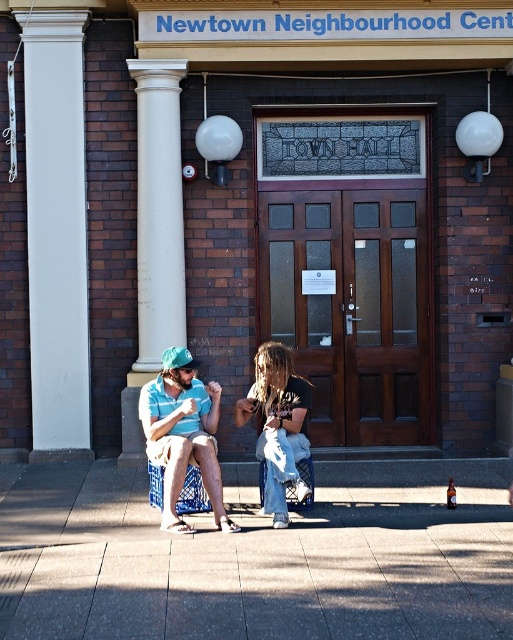
You are standing at the entrance of the Newtown Neighbourhood Centre Town Hall. You see a white smooth pillar at left represented by point (56, 230). Where would you go to find the entrance door?

The entrance door is located to the right of the white smooth pillar at left represented by point (56, 230).